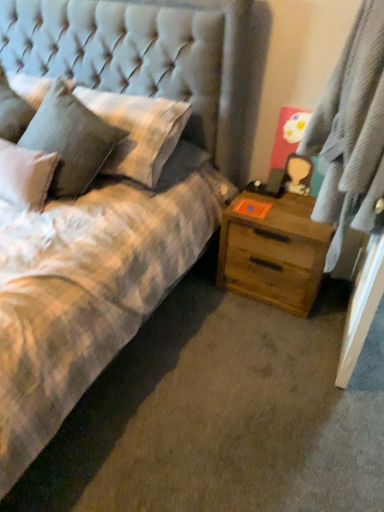
Question: From the image's perspective, would you say wooden nightstand at right is positioned over fluffy white pillow at upper left, acting as the second pillow starting from the right?

Choices:
 (A) no
 (B) yes

Answer: (A)

Question: Does wooden nightstand at right have a smaller size compared to fluffy white pillow at upper left, acting as the second pillow starting from the right?

Choices:
 (A) no
 (B) yes

Answer: (B)

Question: Would you say wooden nightstand at right contains fluffy white pillow at upper left, which appears as the first pillow when viewed from the left?

Choices:
 (A) no
 (B) yes

Answer: (A)

Question: Is wooden nightstand at right facing towards fluffy white pillow at upper left, which appears as the first pillow when viewed from the left?

Choices:
 (A) yes
 (B) no

Answer: (B)

Question: Can you confirm if wooden nightstand at right is wider than fluffy white pillow at upper left, which appears as the first pillow when viewed from the left?

Choices:
 (A) no
 (B) yes

Answer: (A)

Question: Considering the positions of tufted fabric headboard at upper left and gray textured curtain at right in the image, is tufted fabric headboard at upper left wider or thinner than gray textured curtain at right?

Choices:
 (A) wide
 (B) thin

Answer: (A)

Question: Based on their sizes in the image, would you say tufted fabric headboard at upper left is bigger or smaller than gray textured curtain at right?

Choices:
 (A) small
 (B) big

Answer: (A)

Question: Would you say tufted fabric headboard at upper left is to the left or to the right of gray textured curtain at right in the picture?

Choices:
 (A) right
 (B) left

Answer: (B)

Question: From a real-world perspective, is tufted fabric headboard at upper left above or below gray textured curtain at right?

Choices:
 (A) above
 (B) below

Answer: (B)

Question: Based on their sizes in the image, would you say textured gray pillow at upper left, the 1th pillow viewed from the right, is bigger or smaller than tufted fabric headboard at upper left?

Choices:
 (A) big
 (B) small

Answer: (B)

Question: In terms of width, does textured gray pillow at upper left, the 1th pillow viewed from the right, look wider or thinner when compared to tufted fabric headboard at upper left?

Choices:
 (A) wide
 (B) thin

Answer: (B)

Question: From a real-world perspective, is textured gray pillow at upper left, the 1th pillow viewed from the right, positioned above or below tufted fabric headboard at upper left?

Choices:
 (A) below
 (B) above

Answer: (A)

Question: From the image's perspective, is textured gray pillow at upper left, the 1th pillow viewed from the right, positioned above or below tufted fabric headboard at upper left?

Choices:
 (A) below
 (B) above

Answer: (A)

Question: Is gray textured curtain at right wider or thinner than tufted fabric headboard at upper left?

Choices:
 (A) thin
 (B) wide

Answer: (A)

Question: Do you think gray textured curtain at right is within tufted fabric headboard at upper left, or outside of it?

Choices:
 (A) outside
 (B) inside

Answer: (A)